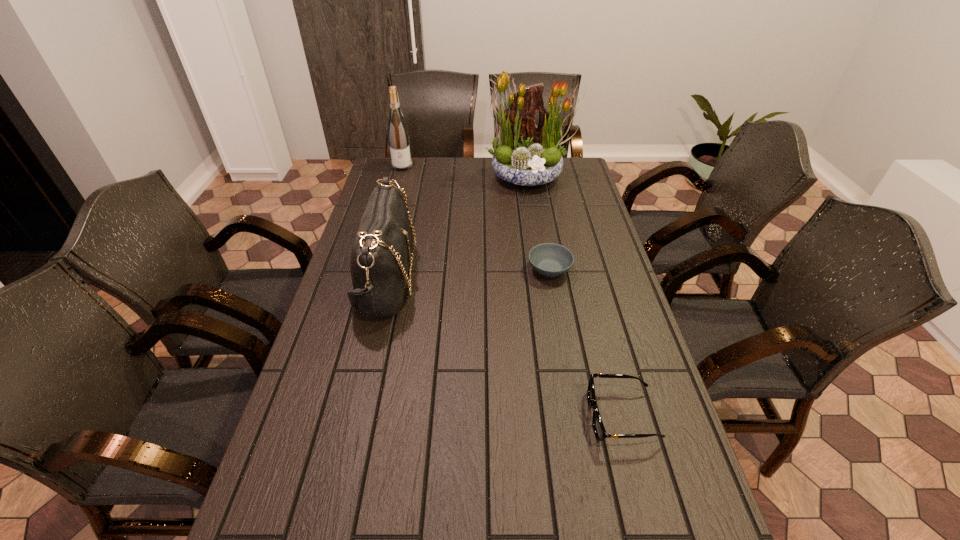
Image resolution: width=960 pixels, height=540 pixels. I want to click on blank space located 0.120m on the front-facing side of the sunglasses, so click(538, 416).

Locate an element on the screen. free space located 0.150m on the left of the soup bowl is located at coordinates (482, 269).

The image size is (960, 540). In order to click on flower arrangement at the far edge in this screenshot , I will do `click(525, 154)`.

Locate an element on the screen. wine bottle present at the far edge is located at coordinates (397, 131).

This screenshot has height=540, width=960. In order to click on wine bottle that is at the left edge in this screenshot , I will do `click(397, 131)`.

Image resolution: width=960 pixels, height=540 pixels. Find the location of `handbag that is at the left edge`. handbag that is at the left edge is located at coordinates (381, 254).

Identify the location of flower arrangement situated at the right edge. (525, 154).

Where is `sunglasses present at the right edge`? The height and width of the screenshot is (540, 960). sunglasses present at the right edge is located at coordinates (598, 427).

The height and width of the screenshot is (540, 960). What are the coordinates of `soup bowl that is at the right edge` in the screenshot? It's located at (551, 260).

Where is `object that is at the far left corner`? The width and height of the screenshot is (960, 540). object that is at the far left corner is located at coordinates (397, 131).